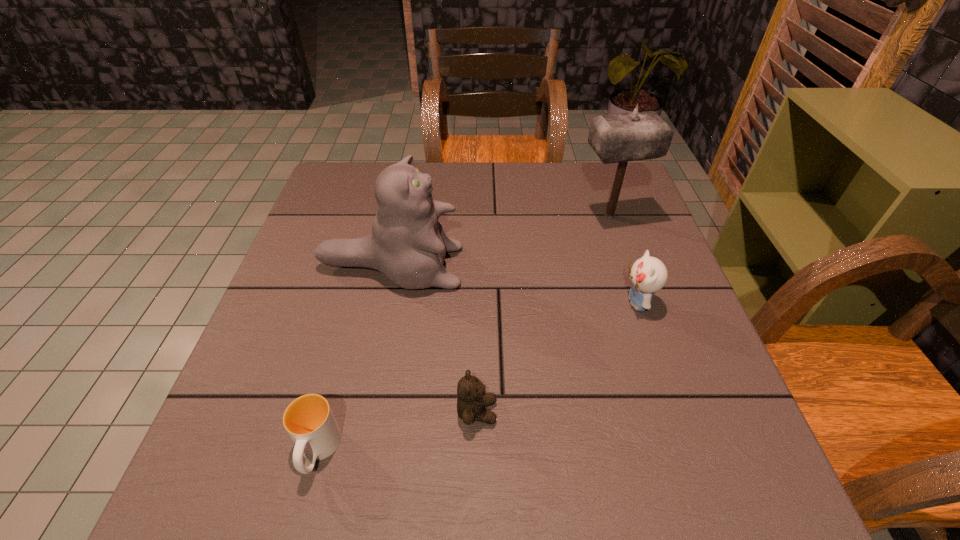
The height and width of the screenshot is (540, 960). I want to click on vacant space located on the face of the third object from left to right, so click(x=667, y=411).

What are the coordinates of `object located in the far edge section of the desktop` in the screenshot? It's located at (616, 138).

Find the location of `object located at the near edge`. object located at the near edge is located at coordinates (309, 421).

What are the coordinates of `cat present at the left edge` in the screenshot? It's located at (407, 244).

Where is `cup at the left edge`? The width and height of the screenshot is (960, 540). cup at the left edge is located at coordinates (309, 421).

Where is `mallet present at the right edge`? The height and width of the screenshot is (540, 960). mallet present at the right edge is located at coordinates (616, 138).

The width and height of the screenshot is (960, 540). I want to click on kitten that is at the right edge, so click(648, 274).

Where is `object that is at the near left corner`? object that is at the near left corner is located at coordinates (309, 421).

Where is `object that is at the far right corner`? object that is at the far right corner is located at coordinates (616, 138).

Find the location of a particular element. The image size is (960, 540). free location at the far edge is located at coordinates (448, 180).